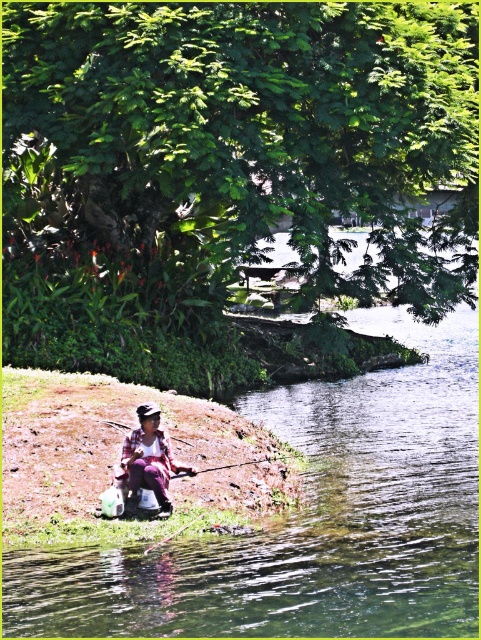
Is clear water at river right wider than purple fabric at lower left?

Yes.

Does clear water at river right have a larger size compared to purple fabric at lower left?

Indeed, clear water at river right has a larger size compared to purple fabric at lower left.

Where is `clear water at river right`? This screenshot has width=481, height=640. clear water at river right is located at coordinates (309, 520).